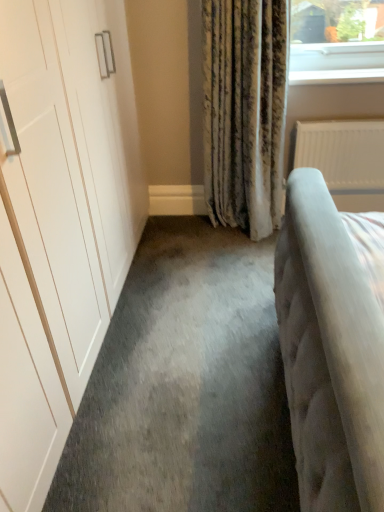
Measure the distance between white glossy window sill at upper right and camera.

white glossy window sill at upper right is 2.30 meters away from camera.

What do you see at coordinates (336, 76) in the screenshot? I see `white glossy window sill at upper right` at bounding box center [336, 76].

Find the location of a particular element. The height and width of the screenshot is (512, 384). white glossy window sill at upper right is located at coordinates (336, 76).

In order to face white glossy window sill at upper right, should I rotate leftwards or rightwards?

A 19.120 degree turn to the right will do.

What is the approximate width of white textured radiator at right?

4.25 inches.

Locate an element on the screen. This screenshot has width=384, height=512. white textured radiator at right is located at coordinates (345, 160).

Describe the element at coordinates (345, 160) in the screenshot. This screenshot has height=512, width=384. I see `white textured radiator at right` at that location.

Identify the location of white glossy window sill at upper right. (336, 76).

Which is more to the right, white textured radiator at right or white glossy window sill at upper right?

From the viewer's perspective, white textured radiator at right appears more on the right side.

Does white textured radiator at right come in front of white glossy window sill at upper right?

No, it is not.

Which is further, (x=350, y=195) or (x=323, y=72)?

The point (x=350, y=195) is farther from the camera.

From the image's perspective, is white textured radiator at right beneath white glossy window sill at upper right?

Yes, from the image's perspective, white textured radiator at right is beneath white glossy window sill at upper right.

In the scene shown: From a real-world perspective, is white textured radiator at right beneath white glossy window sill at upper right?

Yes, from a real-world perspective, white textured radiator at right is below white glossy window sill at upper right.

From the picture: Can you confirm if white textured radiator at right is wider than white glossy window sill at upper right?

No.

Is white textured radiator at right taller than white glossy window sill at upper right?

Indeed, white textured radiator at right has a greater height compared to white glossy window sill at upper right.

Looking at the image, does white textured radiator at right seem bigger or smaller compared to white glossy window sill at upper right?

Considering their sizes, white textured radiator at right takes up more space than white glossy window sill at upper right.

Do you think white textured radiator at right is within white glossy window sill at upper right, or outside of it?

white textured radiator at right exists outside the volume of white glossy window sill at upper right.

Is white textured radiator at right next to white glossy window sill at upper right?

No, white textured radiator at right is not in contact with white glossy window sill at upper right.

Could you tell me if white textured radiator at right is facing white glossy window sill at upper right?

No.

Can you tell me how much white textured radiator at right and white glossy window sill at upper right differ in facing direction?

The facing directions of white textured radiator at right and white glossy window sill at upper right are 0.895 degrees apart.

How much distance is there between white textured radiator at right and white glossy window sill at upper right?

15.38 inches.

Locate an element on the screen. The height and width of the screenshot is (512, 384). window sill that is above the white textured radiator at right (from the image's perspective) is located at coordinates (336, 76).

From the picture: Considering the positions of objects white glossy window sill at upper right and white textured radiator at right in the image provided, who is more to the left, white glossy window sill at upper right or white textured radiator at right?

white glossy window sill at upper right.

In the image, is white glossy window sill at upper right positioned in front of or behind white textured radiator at right?

white glossy window sill at upper right is positioned closer to the viewer than white textured radiator at right.

Is point (373, 74) positioned after point (310, 125)?

No, it is in front of (310, 125).

From the image's perspective, is white glossy window sill at upper right below white textured radiator at right?

No, from the image's perspective, white glossy window sill at upper right is not below white textured radiator at right.

From a real-world perspective, does white glossy window sill at upper right sit lower than white textured radiator at right?

No, from a real-world perspective, white glossy window sill at upper right is not beneath white textured radiator at right.

In terms of width, does white glossy window sill at upper right look wider or thinner when compared to white textured radiator at right?

Considering their sizes, white glossy window sill at upper right looks broader than white textured radiator at right.

Between white glossy window sill at upper right and white textured radiator at right, which one has more height?

Standing taller between the two is white textured radiator at right.

Considering the relative sizes of white glossy window sill at upper right and white textured radiator at right in the image provided, is white glossy window sill at upper right bigger than white textured radiator at right?

No, white glossy window sill at upper right is not bigger than white textured radiator at right.

Is white glossy window sill at upper right inside the boundaries of white textured radiator at right, or outside?

white glossy window sill at upper right lies outside white textured radiator at right.

Is there a large distance between white glossy window sill at upper right and white textured radiator at right?

white glossy window sill at upper right is near white textured radiator at right, not far away.

Based on the photo, is white glossy window sill at upper right facing away from white textured radiator at right?

No, white glossy window sill at upper right's orientation is not away from white textured radiator at right.

How many degrees apart are the facing directions of white glossy window sill at upper right and white textured radiator at right?

0.895 degrees.

Locate an element on the screen. Image resolution: width=384 pixels, height=512 pixels. window sill above the white textured radiator at right (from the image's perspective) is located at coordinates 336,76.

I want to click on radiator behind the white glossy window sill at upper right, so (345, 160).

Identify the location of radiator on the right of the white glossy window sill at upper right. This screenshot has height=512, width=384. (345, 160).